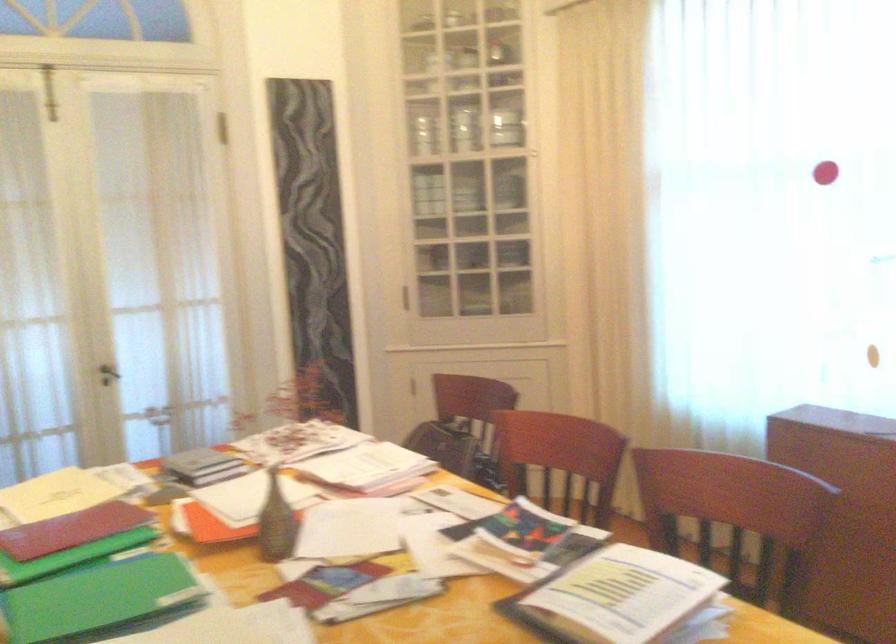
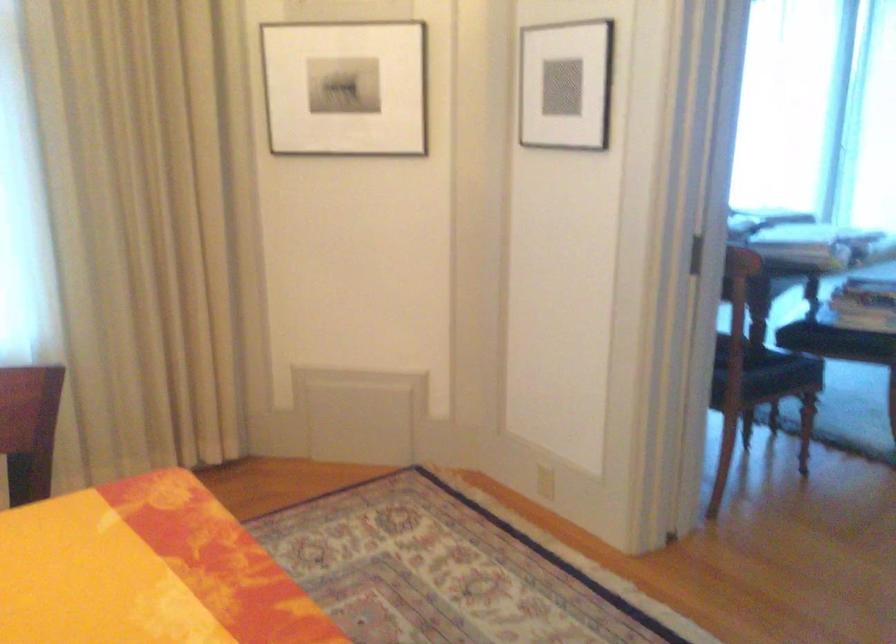
Question: The first image is from the beginning of the video and the second image is from the end. How did the camera likely rotate when shooting the video?

Choices:
 (A) Left
 (B) Right
 (C) Up
 (D) Down

Answer: (B)